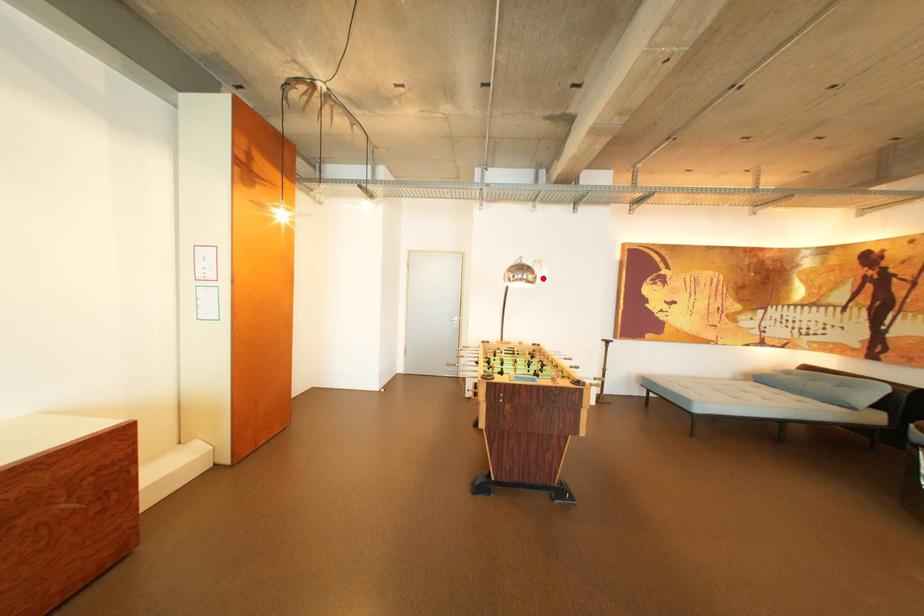
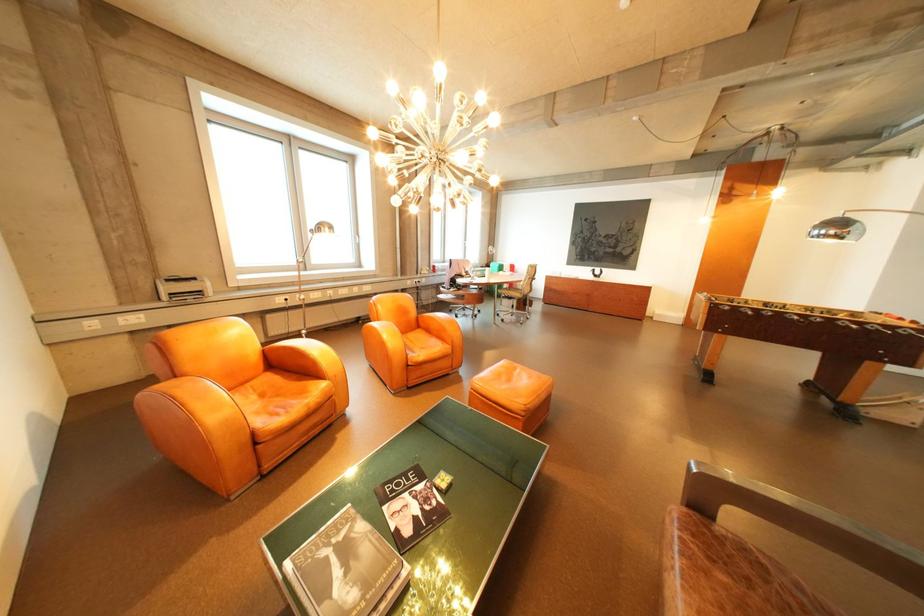
Question: I am providing you with two images of the same scene from different viewpoints. Given a red point in image1, look at the same physical point in image2. Is it:

Choices:
 (A) Closer to the viewpoint
 (B) Farther from the viewpoint

Answer: (B)